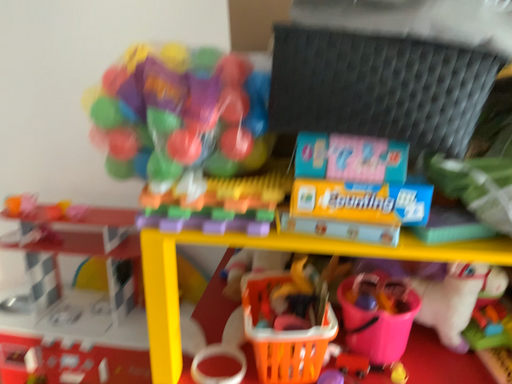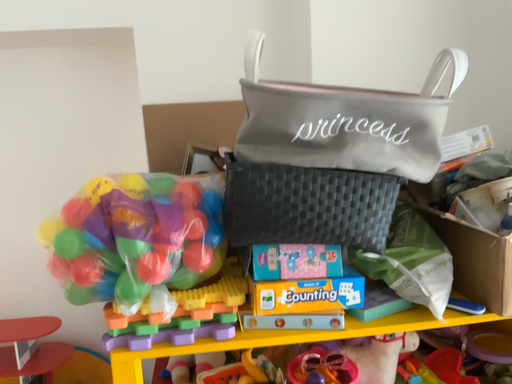
Question: How did the camera likely rotate when shooting the video?

Choices:
 (A) rotated upward
 (B) rotated downward

Answer: (A)